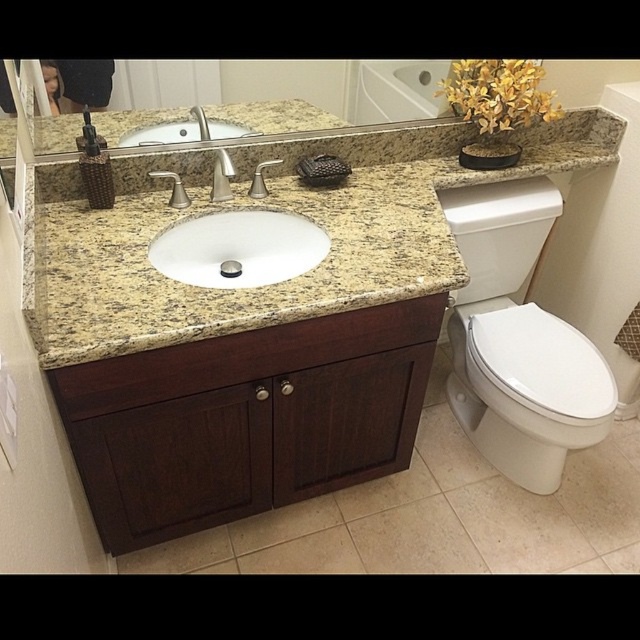
Does white glossy sink at center have a greater width compared to polished granite mirror at upper center?

No, white glossy sink at center is not wider than polished granite mirror at upper center.

This screenshot has width=640, height=640. What do you see at coordinates (237, 248) in the screenshot?
I see `white glossy sink at center` at bounding box center [237, 248].

Locate an element on the screen. white glossy sink at center is located at coordinates [237, 248].

From the picture: Is white glossy sink at center smaller than satin nickel faucet at center?

No, white glossy sink at center is not smaller than satin nickel faucet at center.

Does point (218, 284) come farther from viewer compared to point (216, 161)?

No, (218, 284) is in front of (216, 161).

This screenshot has height=640, width=640. In order to click on white glossy sink at center in this screenshot , I will do `click(237, 248)`.

Between polished granite mirror at upper center and silver metallic faucet at upper center, which one appears on the left side from the viewer's perspective?

Positioned to the left is silver metallic faucet at upper center.

Can you confirm if polished granite mirror at upper center is positioned below silver metallic faucet at upper center?

Correct, polished granite mirror at upper center is located below silver metallic faucet at upper center.

Looking at this image, who is more distant from viewer, (58, 147) or (204, 120)?

The point (204, 120) is behind.

Where is `polished granite mirror at upper center`? This screenshot has height=640, width=640. polished granite mirror at upper center is located at coordinates (252, 134).